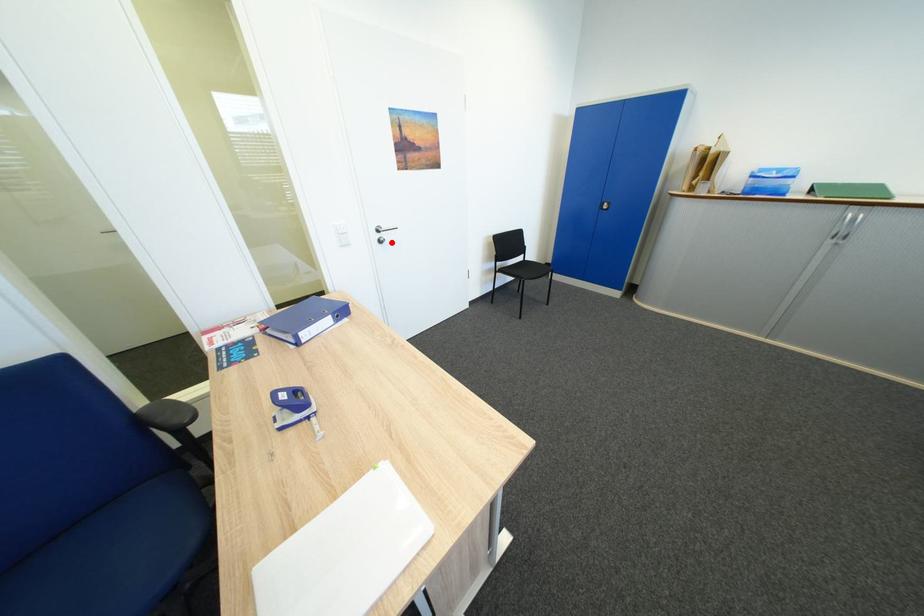
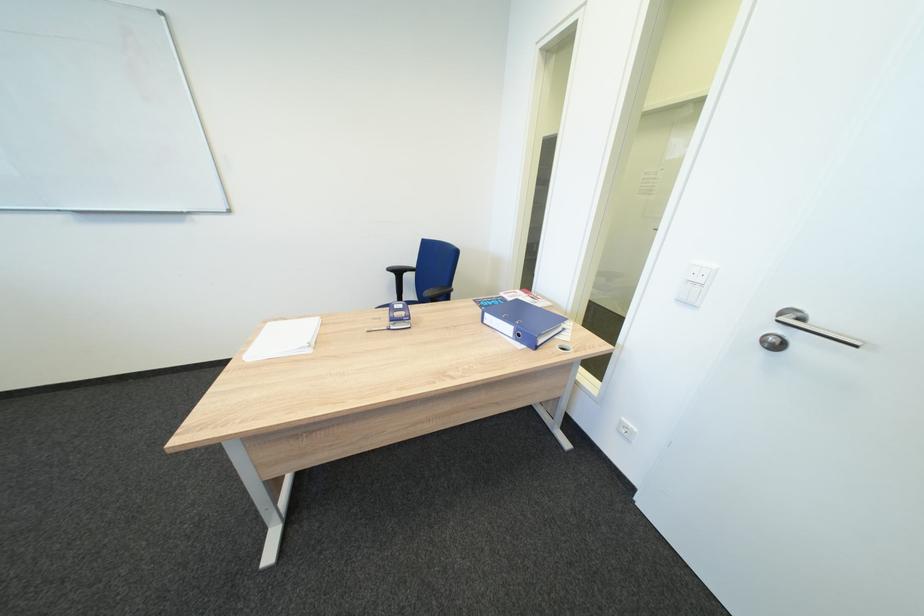
Locate, in the second image, the point that corresponds to the highlighted location in the first image.

(784, 346)